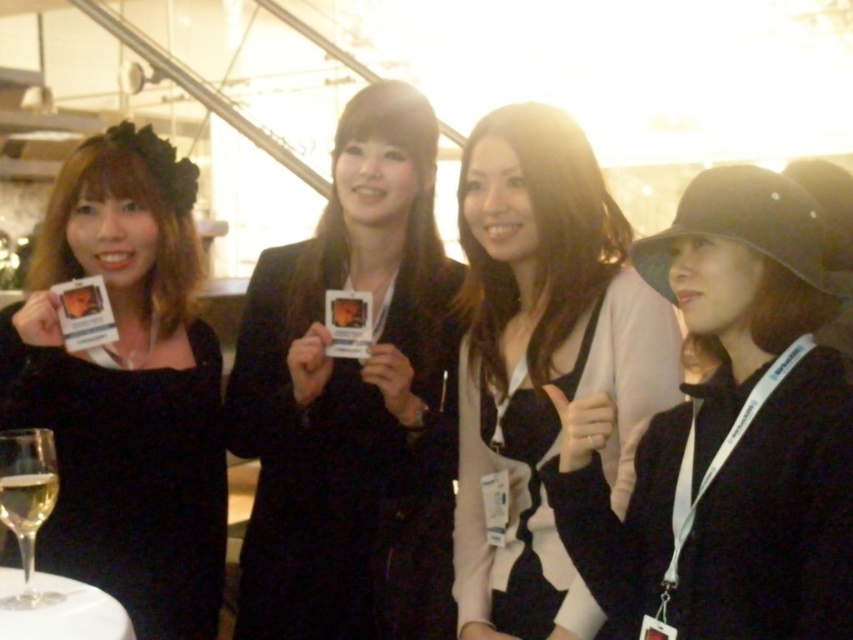
Question: Which object is positioned closest to the matte black cardigan at center?

Choices:
 (A) clear glass wine glass at lower left
 (B) black matte card at left

Answer: (B)

Question: Estimate the real-world distances between objects in this image. Which object is closer to the clear glass table at lower left?

Choices:
 (A) clear glass wine at lower left
 (B) black matte hat at right
 (C) black matte card at left

Answer: (A)

Question: Does black matte jacket at center appear under matte black cardigan at center?

Choices:
 (A) yes
 (B) no

Answer: (B)

Question: Is black matte card at left thinner than black matte dress at center?

Choices:
 (A) yes
 (B) no

Answer: (B)

Question: Can you confirm if clear glass wine glass at lower left is positioned to the right of clear glass table at lower left?

Choices:
 (A) no
 (B) yes

Answer: (A)

Question: Estimate the real-world distances between objects in this image. Which object is farther from the black matte jacket at center?

Choices:
 (A) black matte card at left
 (B) clear glass wine glass at lower left
 (C) clear glass wine at lower left
 (D) matte black cardigan at center

Answer: (C)